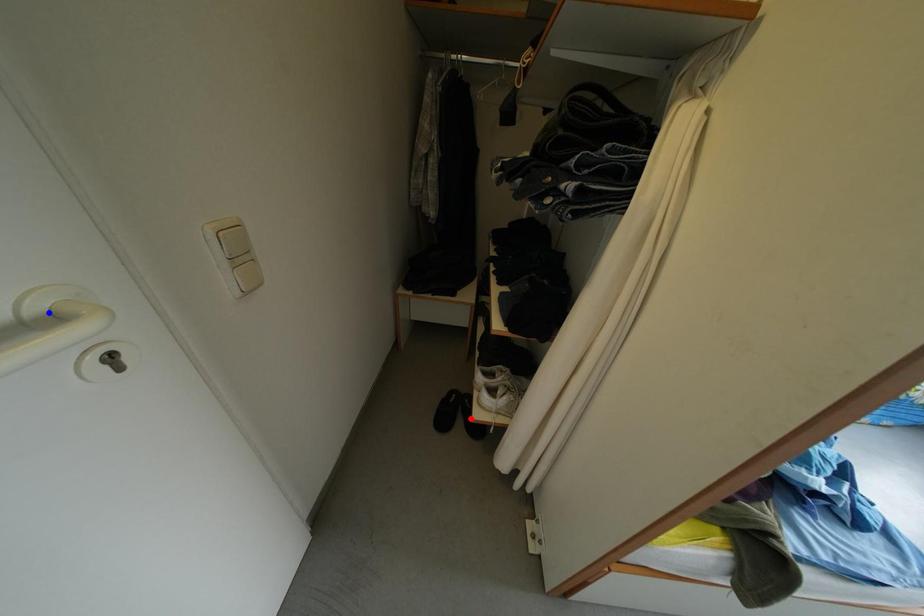
Question: Two points are marked on the image. Which point is closer to the camera?

Choices:
 (A) Blue point is closer.
 (B) Red point is closer.

Answer: (A)